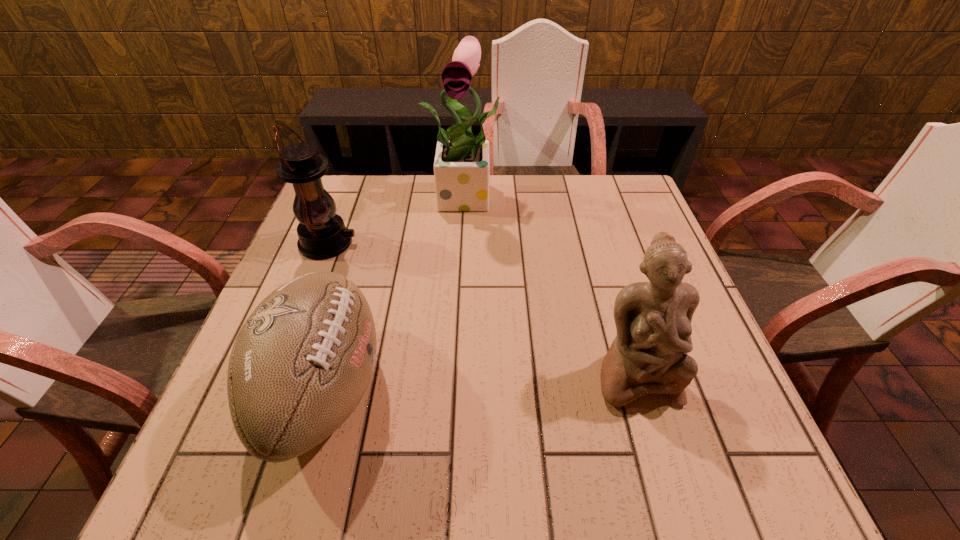
This screenshot has height=540, width=960. I want to click on vacant space in between the figurine and the second object from right to left, so click(x=552, y=285).

You are a GUI agent. You are given a task and a screenshot of the screen. Output one action in this format:
    pyautogui.click(x=<x>, y=<y>)
    Task: Click on the vacant space that is in between the football (American) and the third object from left to right
    The height and width of the screenshot is (540, 960).
    Given the screenshot: What is the action you would take?
    pyautogui.click(x=396, y=293)

At what (x,y) coordinates should I click in order to perform the action: click on object that is the second closest one to the rightmost object. Please return your answer as a coordinate pair (x, y). Looking at the image, I should click on (461, 167).

Locate an element on the screen. This screenshot has height=540, width=960. object that is the second closest to the football (American) is located at coordinates (461, 167).

Identify the location of free space that satisfies the following two spatial constraints: 1. on the front-facing side of the second object from right to left; 2. on the laces of the shortest object. The height and width of the screenshot is (540, 960). (464, 390).

This screenshot has width=960, height=540. In order to click on vacant space that satisfies the following two spatial constraints: 1. on the front-facing side of the tallest object; 2. above the third nearest object, indicating its light source in this screenshot , I will do `click(468, 243)`.

You are a GUI agent. You are given a task and a screenshot of the screen. Output one action in this format:
    pyautogui.click(x=<x>, y=<y>)
    Task: Click on the free spot that satisfies the following two spatial constraints: 1. on the front-facing side of the tallest object; 2. on the laces of the shortest object
    The image size is (960, 540).
    Given the screenshot: What is the action you would take?
    pyautogui.click(x=464, y=390)